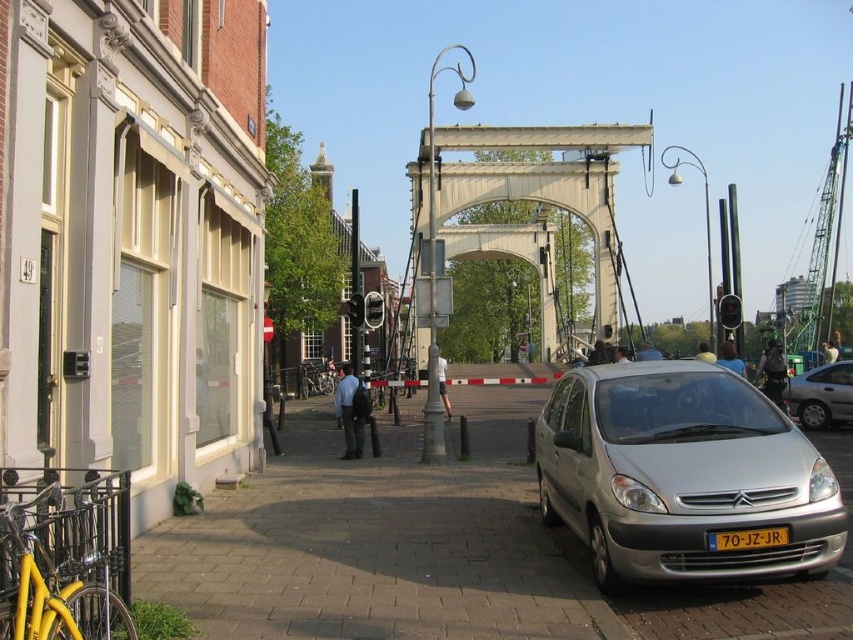
Who is more distant from viewer, (550, 282) or (751, 538)?

The point (550, 282) is behind.

Is white metallic bridge at center to the right of yellow plastic license plate at center from the viewer's perspective?

Yes, white metallic bridge at center is to the right of yellow plastic license plate at center.

Find the location of a particular element. white metallic bridge at center is located at coordinates (538, 204).

Where is `white metallic bridge at center`? white metallic bridge at center is located at coordinates [538, 204].

Can you confirm if light brown leather jacket at center is positioned to the left of yellow fabric cap at center?

Correct, you'll find light brown leather jacket at center to the left of yellow fabric cap at center.

The height and width of the screenshot is (640, 853). In order to click on light brown leather jacket at center in this screenshot , I will do `click(828, 352)`.

Find the location of a particular element. The width and height of the screenshot is (853, 640). light brown leather jacket at center is located at coordinates (828, 352).

Can you confirm if blue denim jacket at center is smaller than white fabric shirt at center?

Yes, blue denim jacket at center is smaller than white fabric shirt at center.

Who is taller, blue denim jacket at center or white fabric shirt at center?

white fabric shirt at center

Identify the location of blue denim jacket at center. (730, 358).